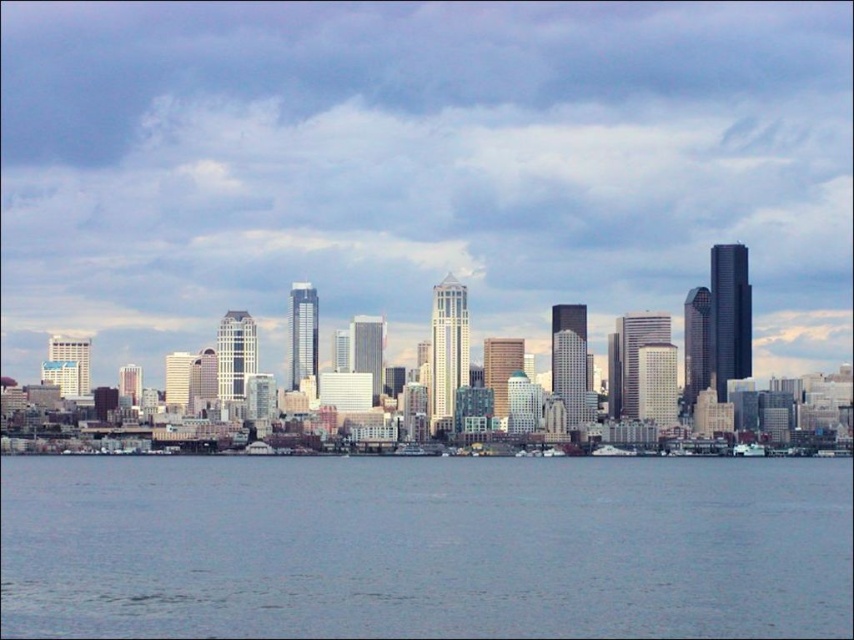
Is gray water at lower center to the right of white glossy boat at center from the viewer's perspective?

No, gray water at lower center is not to the right of white glossy boat at center.

Locate an element on the screen. This screenshot has height=640, width=854. gray water at lower center is located at coordinates (425, 547).

The width and height of the screenshot is (854, 640). Describe the element at coordinates (418, 170) in the screenshot. I see `matte glass skyscrapers at center` at that location.

Who is lower down, matte glass skyscrapers at center or gray water at lower center?

gray water at lower center is lower down.

Is point (347, 93) farther from camera compared to point (747, 500)?

That is False.

At what (x,y) coordinates should I click in order to perform the action: click on matte glass skyscrapers at center. Please return your answer as a coordinate pair (x, y). The image size is (854, 640). Looking at the image, I should click on (418, 170).

Can you confirm if white glossy boat at center is bigger than metallic gray boat at lower right?

Yes, white glossy boat at center is bigger than metallic gray boat at lower right.

You are a GUI agent. You are given a task and a screenshot of the screen. Output one action in this format:
    pyautogui.click(x=<x>, y=<y>)
    Task: Click on the white glossy boat at center
    The height and width of the screenshot is (640, 854).
    Given the screenshot: What is the action you would take?
    pyautogui.click(x=613, y=451)